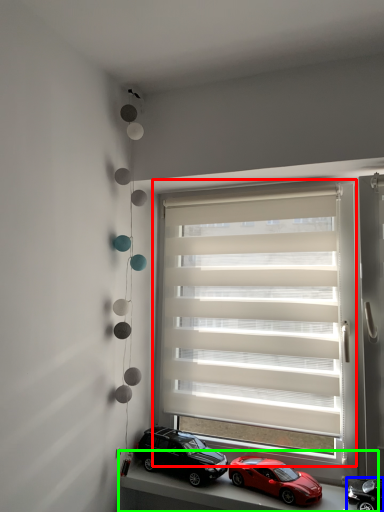
Question: Which is nearer to the window blind (highlighted by a red box)? car (highlighted by a blue box) or window sill (highlighted by a green box).

Choices:
 (A) car
 (B) window sill

Answer: (B)